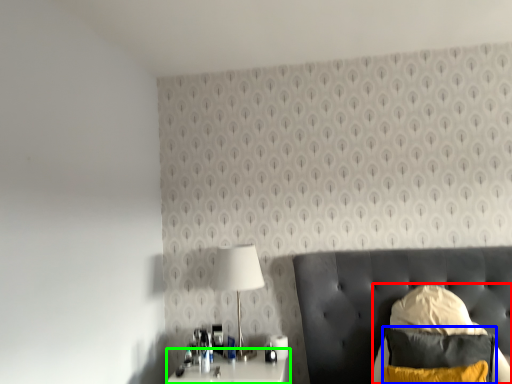
Question: Which object is the farthest from swivel chair (highlighted by a red box)? Choose among these: pillow (highlighted by a blue box) or nightstand (highlighted by a green box).

Choices:
 (A) pillow
 (B) nightstand

Answer: (B)